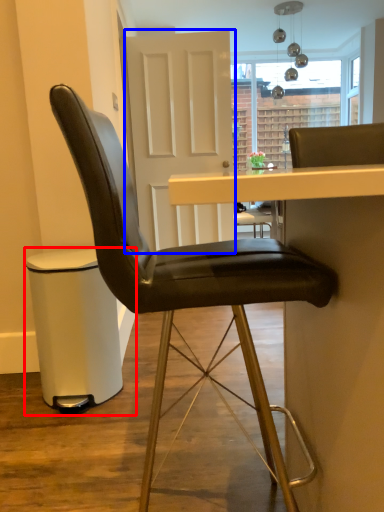
Question: Among these objects, which one is nearest to the camera, bar stool (highlighted by a red box) or glass door (highlighted by a blue box)?

Choices:
 (A) bar stool
 (B) glass door

Answer: (A)